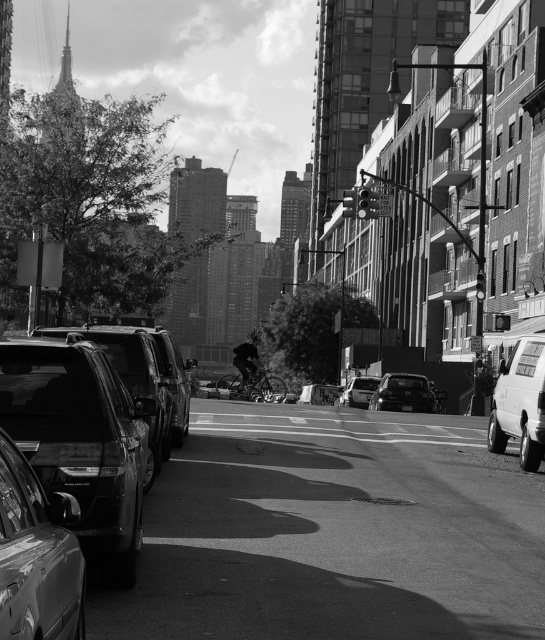
Question: In this image, where is white matte van at right located relative to shiny black sedan at center?

Choices:
 (A) above
 (B) below

Answer: (A)

Question: Which point is closer to the camera?

Choices:
 (A) shiny metallic car at lower left
 (B) white matte van at right

Answer: (A)

Question: Is shiny metallic car at lower left bigger than shiny black sedan at center?

Choices:
 (A) no
 (B) yes

Answer: (A)

Question: Which of the following is the farthest from the observer?

Choices:
 (A) shiny black suv at left
 (B) white matte van at right
 (C) shiny metallic car at lower left

Answer: (B)

Question: Which object is farther from the camera taking this photo?

Choices:
 (A) white matte van at right
 (B) metallic silver sedan at center
 (C) shiny black sedan at center
 (D) shiny metallic car at lower left

Answer: (B)

Question: Is shiny black sedan at center to the left of metallic silver sedan at center from the viewer's perspective?

Choices:
 (A) no
 (B) yes

Answer: (A)